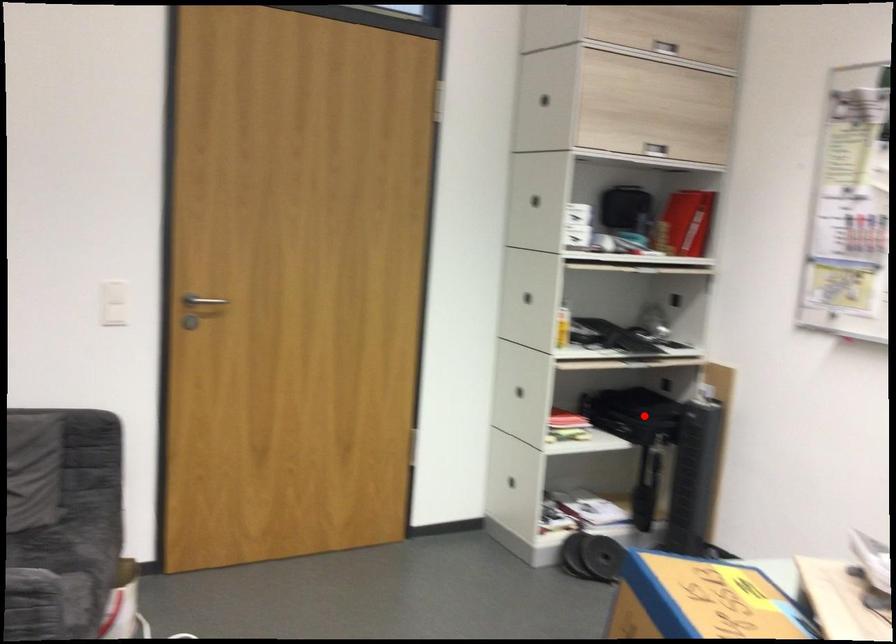
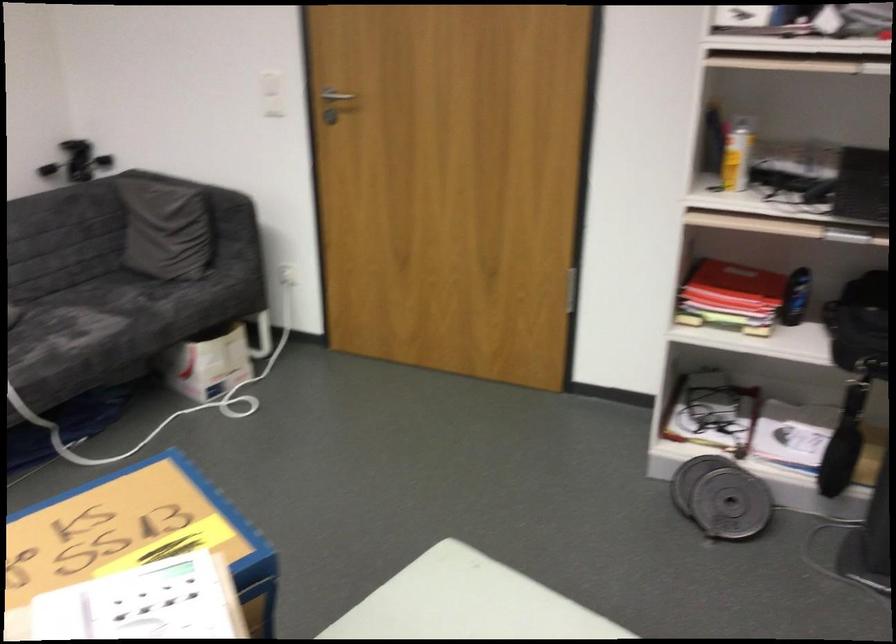
The point at the highlighted location is marked in the first image. Where is the corresponding point in the second image?

(859, 325)